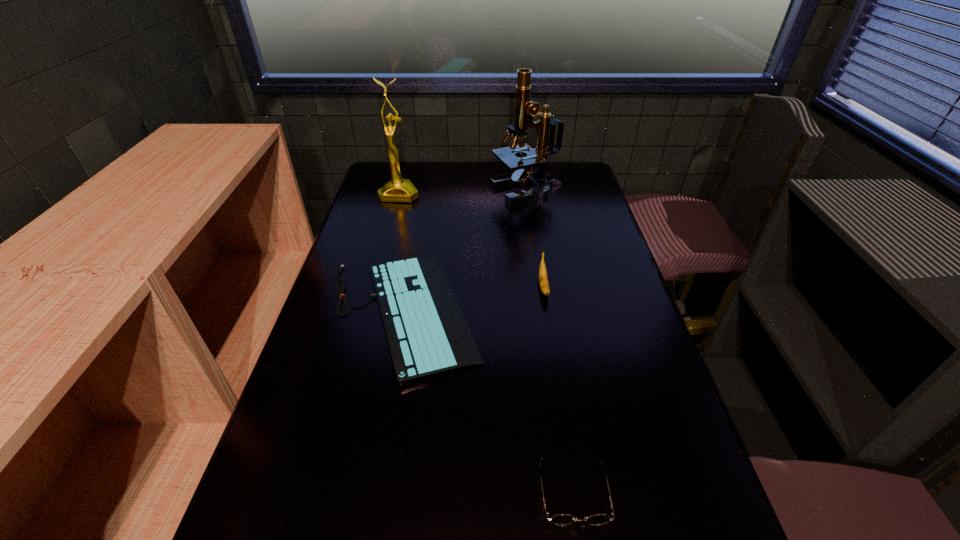
Find the location of a particular element. vacant space at the right edge of the desktop is located at coordinates (x=690, y=468).

This screenshot has width=960, height=540. In the image, there is a desktop. What are the coordinates of `vacant space at the far right corner` in the screenshot? It's located at 588,180.

What are the coordinates of `vacant region between the banana and the nearest object` in the screenshot? It's located at (559, 388).

Identify the location of free space that is in between the banana and the award. The height and width of the screenshot is (540, 960). (471, 240).

You are a GUI agent. You are given a task and a screenshot of the screen. Output one action in this format:
    pyautogui.click(x=<x>, y=<y>)
    Task: Click on the vacant space in between the fourth tallest object and the microscope
    
    Given the screenshot: What is the action you would take?
    pyautogui.click(x=550, y=340)

Where is `free space between the microscope and the shortest object`? The height and width of the screenshot is (540, 960). free space between the microscope and the shortest object is located at coordinates (465, 252).

The image size is (960, 540). In order to click on empty space between the microscope and the third tallest object in this screenshot , I will do `click(535, 239)`.

Where is `free space between the banana and the fourth tallest object`? The image size is (960, 540). free space between the banana and the fourth tallest object is located at coordinates (559, 388).

Identify the location of free spot between the shortest object and the third shortest object. coord(473,300).

This screenshot has height=540, width=960. I want to click on unoccupied area between the award and the microscope, so click(x=463, y=192).